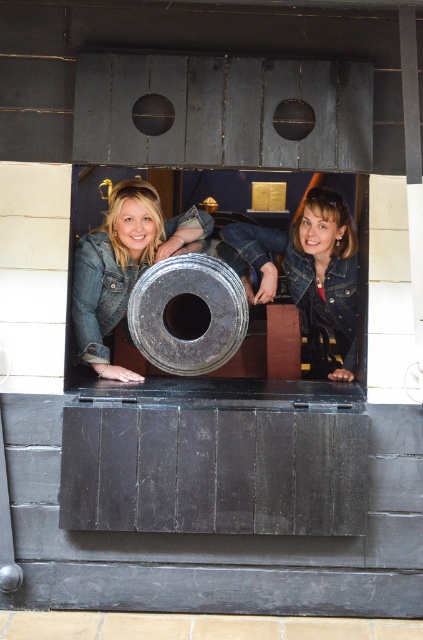
Question: Among these objects, which one is farthest from the camera?

Choices:
 (A) denim jacket at center
 (B) brushed metal denim jacket at lower center

Answer: (A)

Question: Is denim jacket at center wider than brushed metal denim jacket at lower center?

Choices:
 (A) no
 (B) yes

Answer: (B)

Question: Can you confirm if denim jacket at center is thinner than brushed metal denim jacket at lower center?

Choices:
 (A) no
 (B) yes

Answer: (A)

Question: Which of the following is the closest to the observer?

Choices:
 (A) (79, 328)
 (B) (304, 269)

Answer: (A)

Question: Considering the relative positions of denim jacket at center and brushed metal denim jacket at lower center in the image provided, where is denim jacket at center located with respect to brushed metal denim jacket at lower center?

Choices:
 (A) right
 (B) left

Answer: (A)